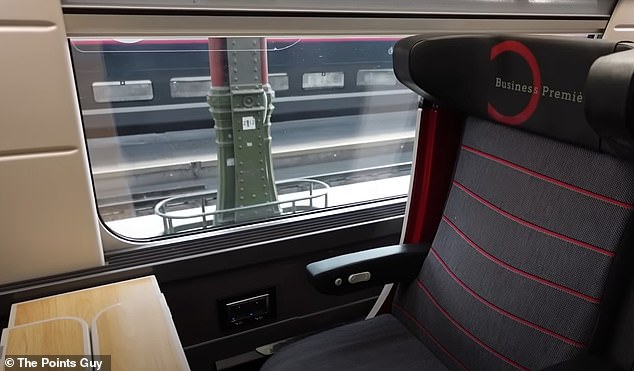
I want to click on table extensions, so click(x=133, y=318), click(x=34, y=329).